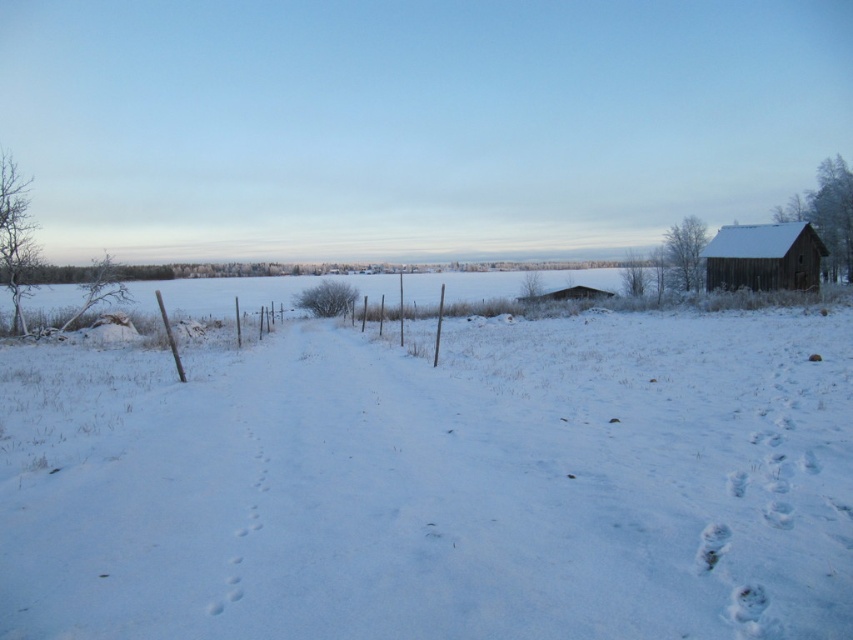
Question: Does white fluffy snow at center appear under wooden barn at right?

Choices:
 (A) yes
 (B) no

Answer: (A)

Question: Is white fluffy snow at center thinner than wooden barn at right?

Choices:
 (A) no
 (B) yes

Answer: (A)

Question: Which object appears closest to the camera in this image?

Choices:
 (A) wooden barn at right
 (B) white fluffy snow at center

Answer: (B)

Question: Which object appears closest to the camera in this image?

Choices:
 (A) white fluffy snow at center
 (B) wooden barn at right

Answer: (A)

Question: Can you confirm if white fluffy snow at center is bigger than wooden barn at right?

Choices:
 (A) yes
 (B) no

Answer: (A)

Question: Which of the following is the closest to the observer?

Choices:
 (A) white fluffy snow at center
 (B) wooden barn at right

Answer: (A)